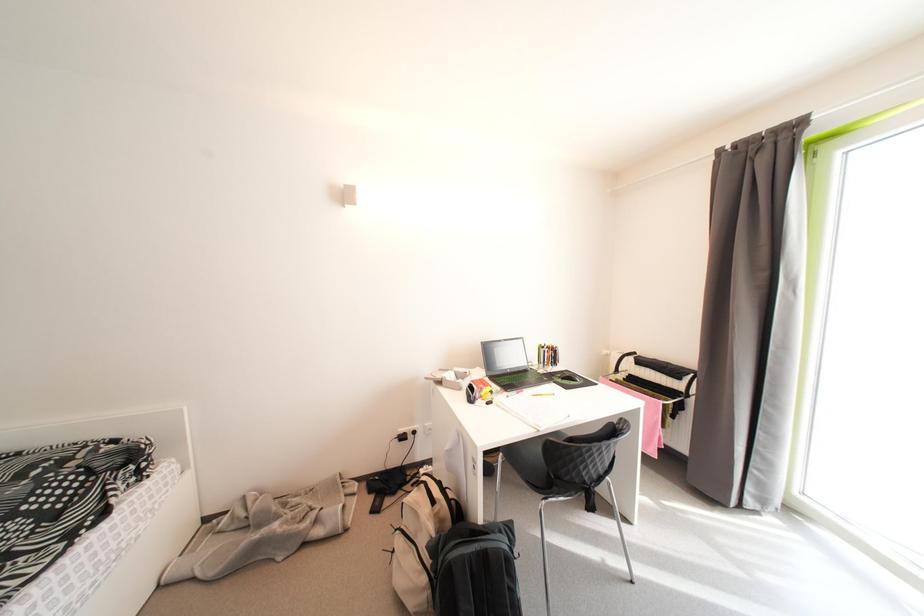
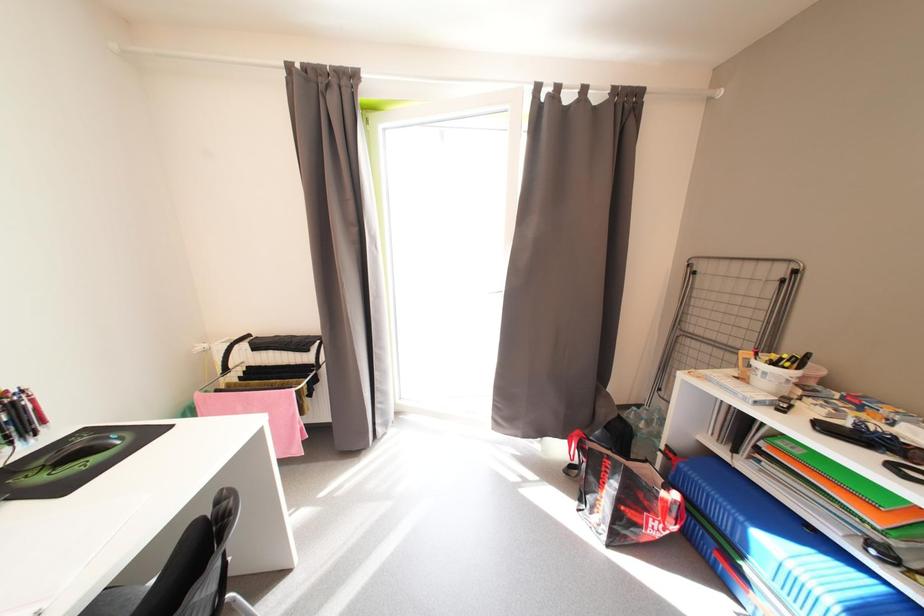
Question: The camera is either moving clockwise (left) or counter-clockwise (right) around the object. The first image is from the beginning of the video and the second image is from the end. Is the camera moving left or right when shooting the video?

Choices:
 (A) Left
 (B) Right

Answer: (A)